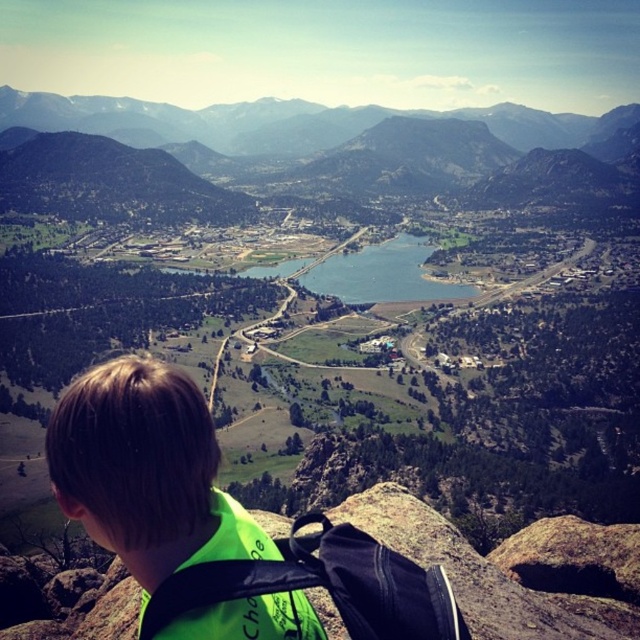
Between point (92, 124) and point (243, 612), which one is positioned behind?

The point (92, 124) is behind.

Can you confirm if green grassy mountain at upper center is positioned below neon green fabric safety vest at lower left?

No, green grassy mountain at upper center is not below neon green fabric safety vest at lower left.

What are the coordinates of `green grassy mountain at upper center` in the screenshot? It's located at (368, 147).

Can you confirm if green grassy mountain at upper center is positioned to the left of neon green backpack at lower left?

No, green grassy mountain at upper center is not to the left of neon green backpack at lower left.

Is green grassy mountain at upper center thinner than neon green backpack at lower left?

Incorrect, green grassy mountain at upper center's width is not less than neon green backpack at lower left's.

Which is behind, point (228, 154) or point (241, 522)?

The point (228, 154) is behind.

Identify the location of green grassy mountain at upper center. This screenshot has width=640, height=640. (368, 147).

Is neon green backpack at lower left positioned at the back of neon green fabric safety vest at lower left?

Yes, it is behind neon green fabric safety vest at lower left.

Between neon green backpack at lower left and neon green fabric safety vest at lower left, which one is positioned lower?

neon green fabric safety vest at lower left is below.

Who is more forward, (x=118, y=396) or (x=202, y=612)?

Point (x=202, y=612)

What are the coordinates of `neon green backpack at lower left` in the screenshot? It's located at (147, 472).